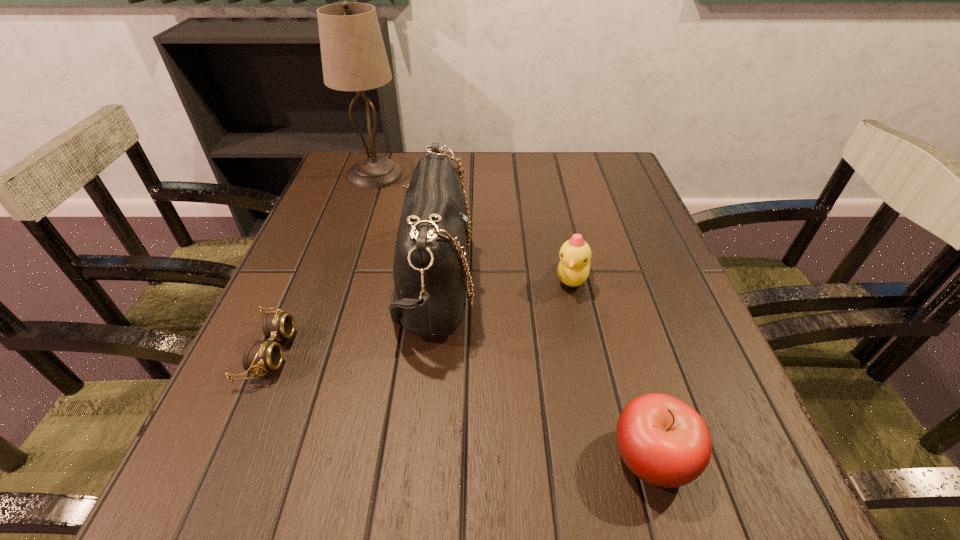
You are a GUI agent. You are given a task and a screenshot of the screen. Output one action in this format:
    pyautogui.click(x=<x>, y=<y>)
    Task: Click on the vacant space located on the left of the apple
    This screenshot has height=540, width=960.
    Given the screenshot: What is the action you would take?
    pyautogui.click(x=374, y=457)

Identify the location of free space located 0.360m through the lenses of the goggles. 501,352.

This screenshot has width=960, height=540. I want to click on object that is positioned at the far edge, so click(x=354, y=58).

The width and height of the screenshot is (960, 540). I want to click on object that is at the near edge, so click(663, 441).

At what (x,y) coordinates should I click in order to perform the action: click on lampshade located at the left edge. Please return your answer as a coordinate pair (x, y). The image size is (960, 540). Looking at the image, I should click on (354, 58).

Find the location of a particular element. The image size is (960, 540). goggles that is at the left edge is located at coordinates (259, 356).

Find the location of a particular element. The image size is (960, 540). object that is at the right edge is located at coordinates (663, 441).

Locate an element on the screen. object that is at the far left corner is located at coordinates (354, 58).

Image resolution: width=960 pixels, height=540 pixels. Identify the location of object situated at the near right corner. (663, 441).

The height and width of the screenshot is (540, 960). Find the location of `free spot at the far edge of the desktop`. free spot at the far edge of the desktop is located at coordinates (550, 170).